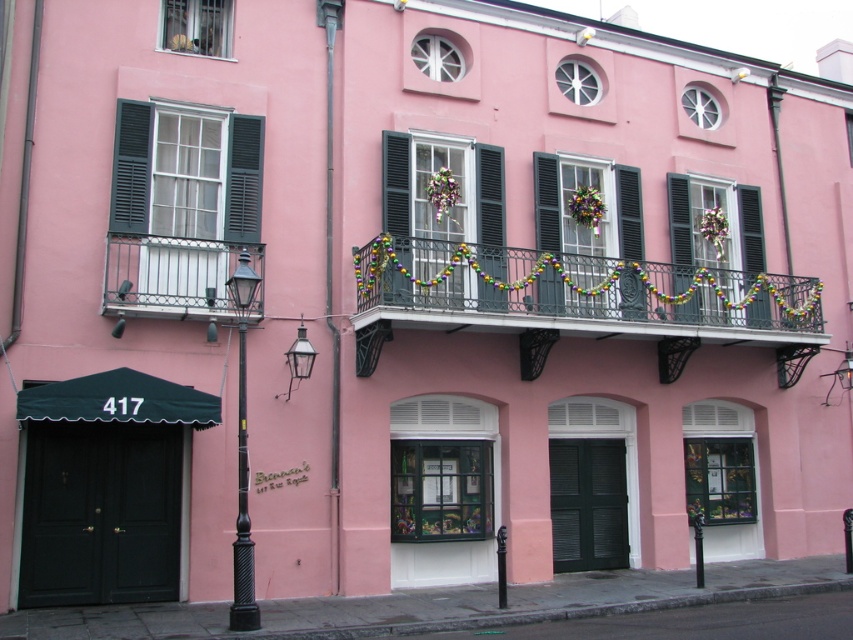
You are a delivery person who needs to place a package between the black matte shutter at center and the green matte shutter at center. The package is 5 feet long. Will it fit between them?

The black matte shutter at center and green matte shutter at center are 5.17 feet apart from each other, so the package which is 5 feet long will fit between them since it is shorter than the distance between the shutters.

You are standing in front of the two story building and want to hang a decorative banner from the white wrought iron balcony at center. However, you notice the black matte shutter at upper right might block the banner. Based on the scene description, will the banner be visible from the street below?

The white wrought iron balcony at center is positioned under the black matte shutter at upper right, so the shutter will block part of the banner, making it less visible from the street below.

You are a delivery person trying to place a package on the lower part of the building. You have two shutters in front of you, the black matte shutter at center and the green matte shutter at center. Which shutter should you avoid placing the package near if you want to ensure it doesn,t get blocked by the shutter?

The black matte shutter at center is shorter than the green matte shutter at center. Therefore, placing the package near the black matte shutter at center would be less likely to get blocked since it is shorter.